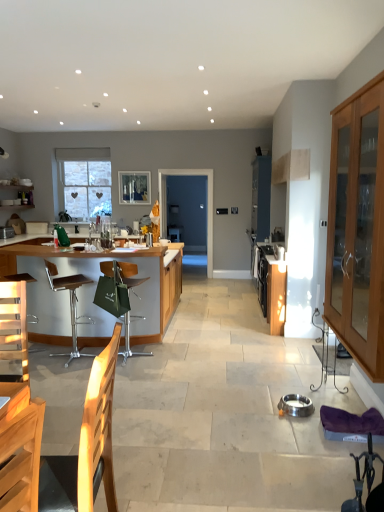
I want to click on vacant region in front of wooden cabinet at center, placed as the third cabinetry when sorted from front to back, so click(x=279, y=340).